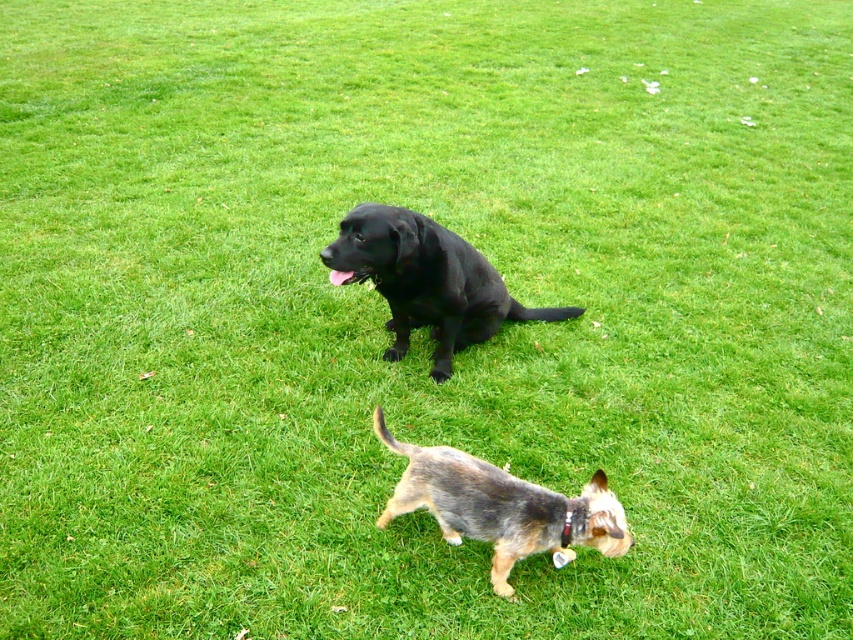
Question: Is black matte dog at center to the left of spotted fur dog at center from the viewer's perspective?

Choices:
 (A) yes
 (B) no

Answer: (A)

Question: Which point appears farthest from the camera in this image?

Choices:
 (A) (355, 268)
 (B) (374, 419)

Answer: (A)

Question: Is black matte dog at center below spotted fur dog at center?

Choices:
 (A) yes
 (B) no

Answer: (B)

Question: Which point is farther to the camera?

Choices:
 (A) spotted fur dog at center
 (B) black matte dog at center

Answer: (B)

Question: Can you confirm if black matte dog at center is positioned to the right of spotted fur dog at center?

Choices:
 (A) yes
 (B) no

Answer: (B)